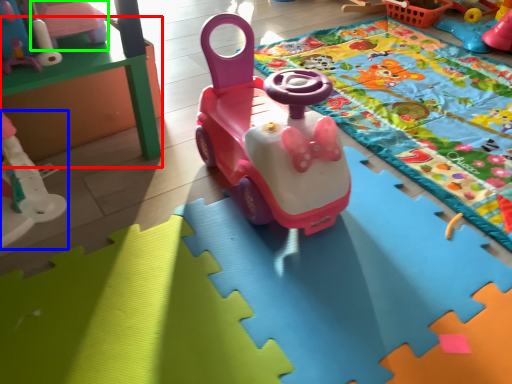
Question: Based on their relative distances, which object is nearer to table (highlighted by a red box)? Choose from toy (highlighted by a blue box) and toy (highlighted by a green box).

Choices:
 (A) toy
 (B) toy

Answer: (B)